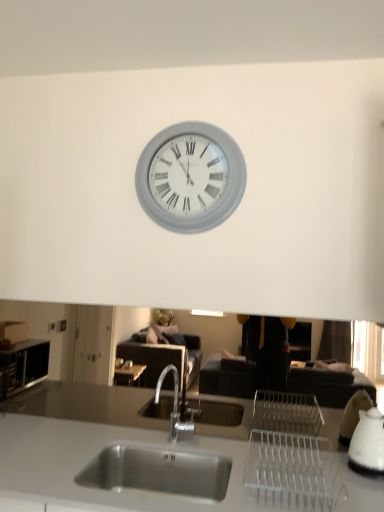
Image resolution: width=384 pixels, height=512 pixels. I want to click on vacant space underneath gray matte clock at upper center (from a real-world perspective), so click(177, 434).